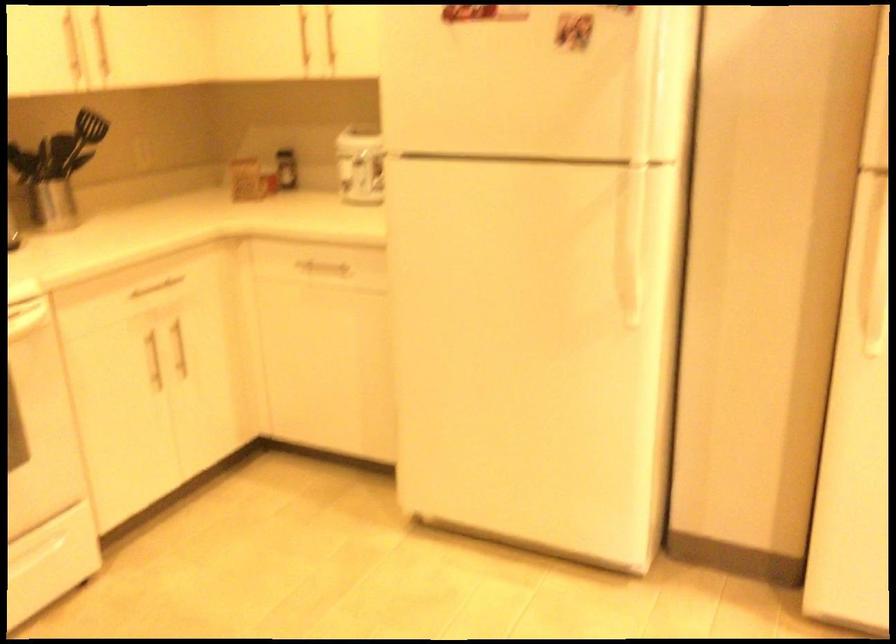
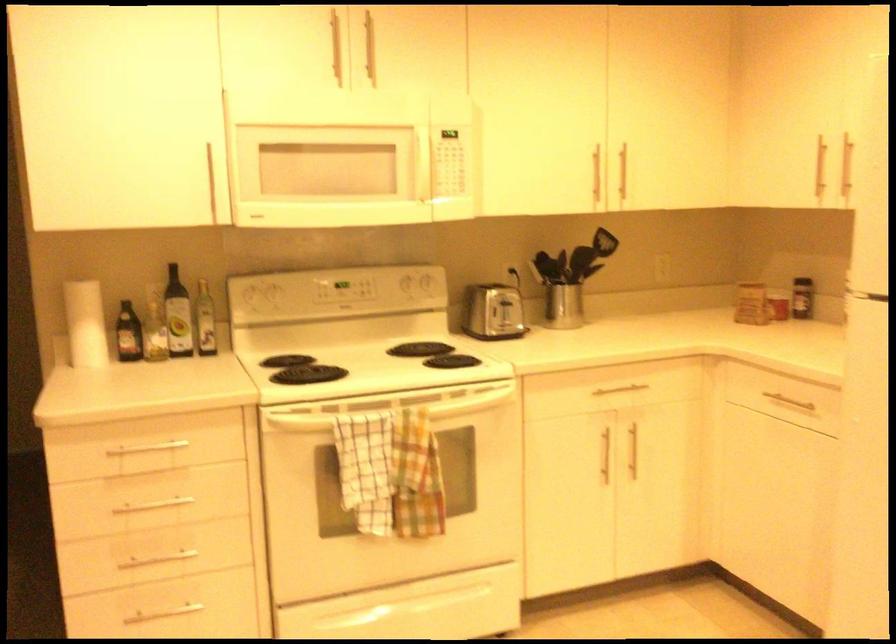
Question: The first image is from the beginning of the video and the second image is from the end. How did the camera likely rotate when shooting the video?

Choices:
 (A) Left
 (B) Right
 (C) Up
 (D) Down

Answer: (A)